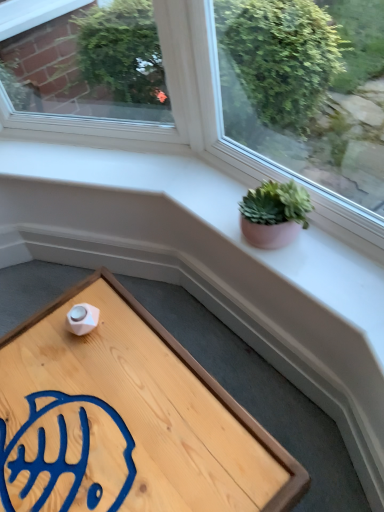
Identify the location of vacant space in front of green succulent in clay pot at upper right. (322, 279).